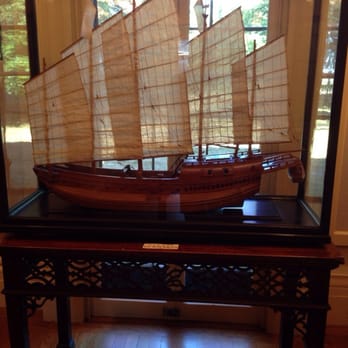
Locate an element on the screen. The width and height of the screenshot is (348, 348). glass enclosure is located at coordinates (315, 98).